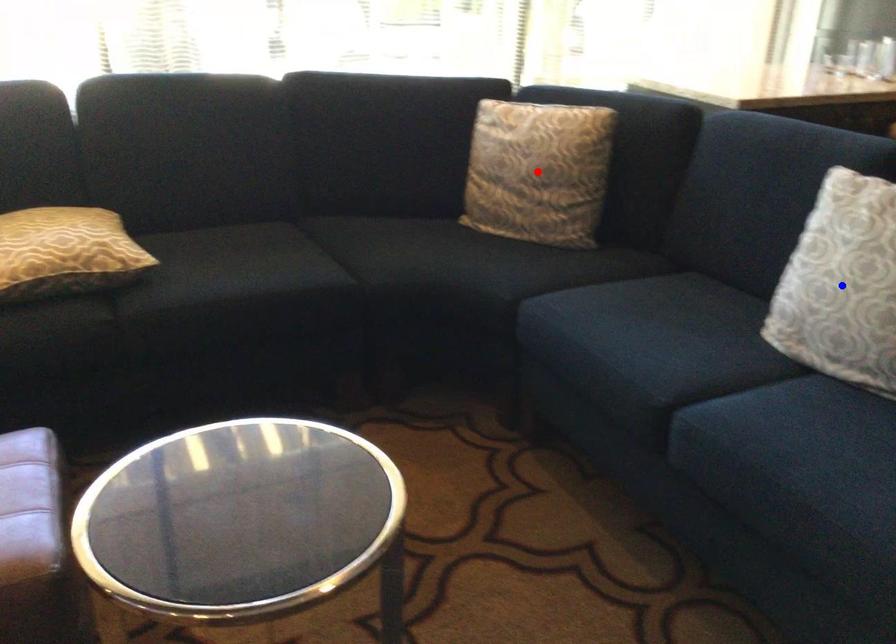
Question: In the image, two points are highlighted. Which point is nearer to the camera? Reply with the corresponding letter.

Choices:
 (A) blue point
 (B) red point

Answer: (A)